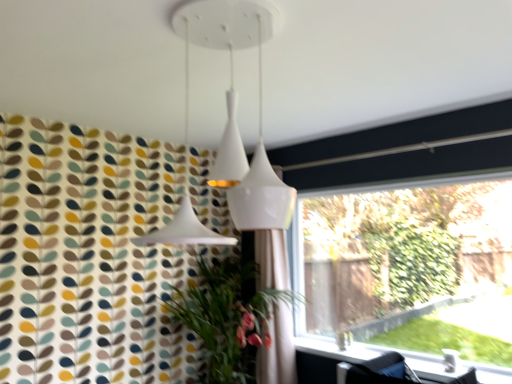
Question: Is transparent glass window at right at the left side of white fabric shower curtain at center?

Choices:
 (A) no
 (B) yes

Answer: (A)

Question: Is transparent glass window at right looking in the opposite direction of white fabric shower curtain at center?

Choices:
 (A) no
 (B) yes

Answer: (A)

Question: Is the depth of transparent glass window at right less than that of white fabric shower curtain at center?

Choices:
 (A) yes
 (B) no

Answer: (A)

Question: From the image's perspective, would you say transparent glass window at right is shown under white fabric shower curtain at center?

Choices:
 (A) yes
 (B) no

Answer: (B)

Question: Considering the relative sizes of transparent glass window at right and white fabric shower curtain at center in the image provided, is transparent glass window at right wider than white fabric shower curtain at center?

Choices:
 (A) yes
 (B) no

Answer: (B)

Question: Is transparent glass window at right taller or shorter than white fabric shower curtain at center?

Choices:
 (A) short
 (B) tall

Answer: (A)

Question: From a real-world perspective, is transparent glass window at right above or below white fabric shower curtain at center?

Choices:
 (A) above
 (B) below

Answer: (A)

Question: Is transparent glass window at right bigger or smaller than white fabric shower curtain at center?

Choices:
 (A) small
 (B) big

Answer: (B)

Question: Considering the positions of point (375, 261) and point (288, 380), is point (375, 261) closer or farther from the camera than point (288, 380)?

Choices:
 (A) closer
 (B) farther

Answer: (B)

Question: Is transparent glass window at right inside the boundaries of white glossy window sill at lower right, or outside?

Choices:
 (A) outside
 (B) inside

Answer: (A)

Question: Is point (456, 307) closer or farther from the camera than point (437, 372)?

Choices:
 (A) farther
 (B) closer

Answer: (A)

Question: In the image, is transparent glass window at right positioned in front of or behind white glossy window sill at lower right?

Choices:
 (A) behind
 (B) front

Answer: (A)

Question: Considering the relative positions of transparent glass window at right and white glossy window sill at lower right in the image provided, is transparent glass window at right to the left or to the right of white glossy window sill at lower right?

Choices:
 (A) right
 (B) left

Answer: (A)

Question: Choose the correct answer: Is white fabric shower curtain at center inside green leafy plant at lower left or outside it?

Choices:
 (A) outside
 (B) inside

Answer: (B)

Question: Is white fabric shower curtain at center to the left or to the right of green leafy plant at lower left in the image?

Choices:
 (A) left
 (B) right

Answer: (B)